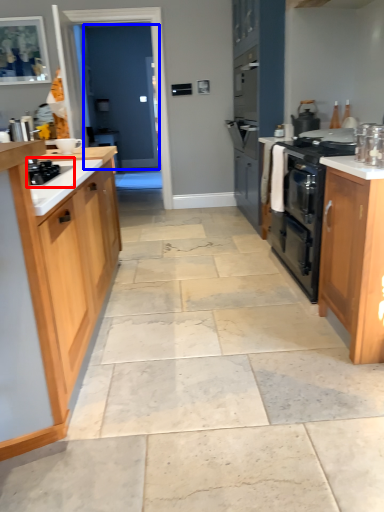
Question: Which of the following is the farthest to the observer, gas stove (highlighted by a red box) or glass door (highlighted by a blue box)?

Choices:
 (A) gas stove
 (B) glass door

Answer: (B)